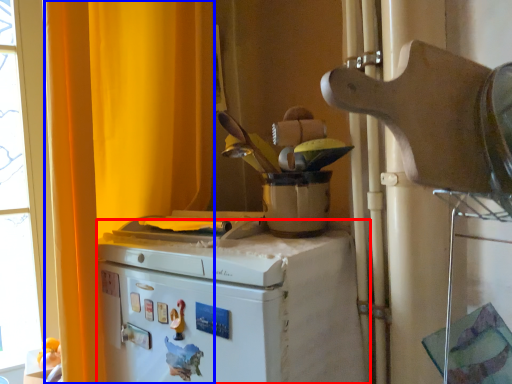
Question: Among these objects, which one is nearest to the camera, home appliance (highlighted by a red box) or curtain (highlighted by a blue box)?

Choices:
 (A) home appliance
 (B) curtain

Answer: (A)